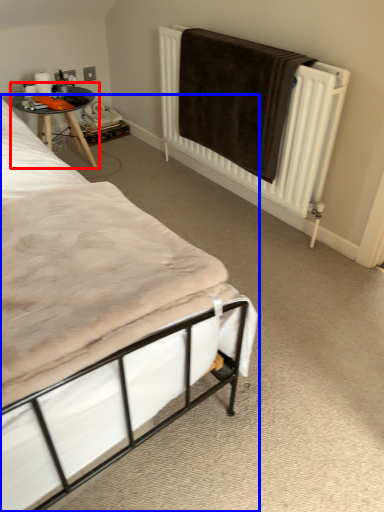
Question: Which object appears farthest to the camera in this image, table (highlighted by a red box) or bed (highlighted by a blue box)?

Choices:
 (A) table
 (B) bed

Answer: (A)